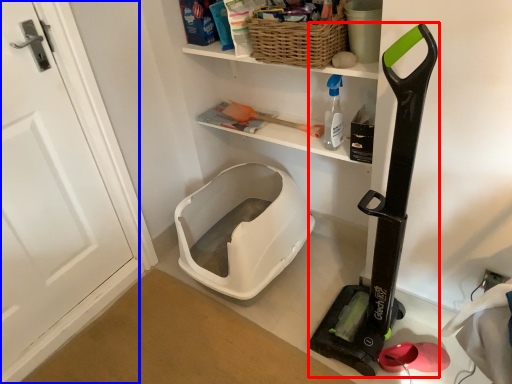
Question: Which object is further to the camera taking this photo, appliance (highlighted by a red box) or door (highlighted by a blue box)?

Choices:
 (A) appliance
 (B) door

Answer: (B)